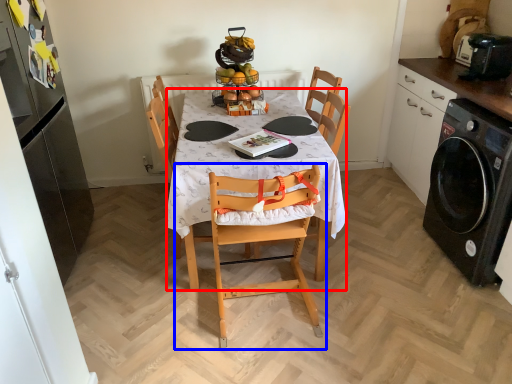
Question: Which object is further to the camera taking this photo, desk (highlighted by a red box) or chair (highlighted by a blue box)?

Choices:
 (A) desk
 (B) chair

Answer: (A)